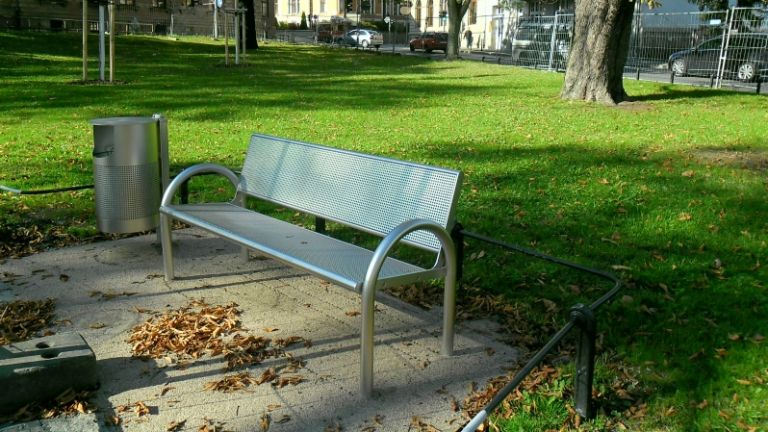
Where is `arm rests`? The height and width of the screenshot is (432, 768). arm rests is located at coordinates (422, 222), (196, 167).